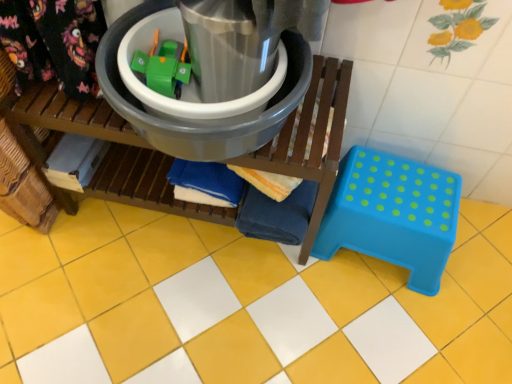
Describe the element at coordinates (195, 124) in the screenshot. I see `metallic plastic bucket at center` at that location.

You are a GUI agent. You are given a task and a screenshot of the screen. Output one action in this format:
    pyautogui.click(x=<x>, y=<y>)
    Task: Click on the matte plastic bucket at center
    The width and height of the screenshot is (512, 384).
    Given the screenshot: What is the action you would take?
    pyautogui.click(x=106, y=156)

How many degrees apart are the facing directions of blue plastic step stool at lower right and metallic plastic bucket at center?

They differ by 0.0796 degrees in their facing directions.

From the image's perspective, would you say blue plastic step stool at lower right is positioned over metallic plastic bucket at center?

Actually, blue plastic step stool at lower right appears below metallic plastic bucket at center in the image.

Locate an element on the screen. The image size is (512, 384). appliance above the blue plastic step stool at lower right (from the image's perspective) is located at coordinates (195, 124).

How different are the orientations of yellow glossy tile at center and metallic plastic bucket at center in degrees?

91.8 degrees separate the facing orientations of yellow glossy tile at center and metallic plastic bucket at center.

Is yellow glossy tile at center closer to camera compared to metallic plastic bucket at center?

No, it is not.

Is yellow glossy tile at center bigger than metallic plastic bucket at center?

Indeed, yellow glossy tile at center has a larger size compared to metallic plastic bucket at center.

I want to click on ceramic tile located below the metallic plastic bucket at center (from the image's perspective), so click(x=244, y=305).

Is matte plastic bucket at center to the left of blue plastic step stool at lower right from the viewer's perspective?

Yes, matte plastic bucket at center is to the left of blue plastic step stool at lower right.

Which object is more forward, matte plastic bucket at center or blue plastic step stool at lower right?

matte plastic bucket at center is closer to the camera.

Which of these two, matte plastic bucket at center or blue plastic step stool at lower right, stands shorter?

blue plastic step stool at lower right is shorter.

Is yellow glossy tile at center oriented away from blue plastic step stool at lower right?

yellow glossy tile at center does not have its back to blue plastic step stool at lower right.

In the scene shown: Is the surface of yellow glossy tile at center in direct contact with blue plastic step stool at lower right?

No, yellow glossy tile at center is not touching blue plastic step stool at lower right.

Does yellow glossy tile at center appear on the left side of blue plastic step stool at lower right?

Correct, you'll find yellow glossy tile at center to the left of blue plastic step stool at lower right.

Which of these two, metallic plastic bucket at center or matte plastic bucket at center, stands shorter?

metallic plastic bucket at center.

Which is behind, point (118, 73) or point (339, 153)?

The point (339, 153) is farther from the camera.

Is metallic plastic bucket at center located outside matte plastic bucket at center?

Absolutely, metallic plastic bucket at center is external to matte plastic bucket at center.

In the image, is metallic plastic bucket at center positioned in front of or behind matte plastic bucket at center?

Clearly, metallic plastic bucket at center is in front of matte plastic bucket at center.

Considering the points (435, 198) and (115, 170), which point is in front, point (435, 198) or point (115, 170)?

The point (435, 198) is closer to the camera.

Is blue plastic step stool at lower right positioned with its back to matte plastic bucket at center?

blue plastic step stool at lower right does not have its back to matte plastic bucket at center.

Can you tell me how much blue plastic step stool at lower right and matte plastic bucket at center differ in facing direction?

1.44 degrees separate the facing orientations of blue plastic step stool at lower right and matte plastic bucket at center.

Relative to matte plastic bucket at center, is blue plastic step stool at lower right in front or behind?

blue plastic step stool at lower right is positioned farther from the viewer than matte plastic bucket at center.

Between blue plastic step stool at lower right and yellow glossy tile at center, which one has smaller size?

With smaller size is blue plastic step stool at lower right.

Which is farther, (425, 177) or (154, 272)?

The point (154, 272) is farther.

From the image's perspective, between blue plastic step stool at lower right and yellow glossy tile at center, which one is located above?

blue plastic step stool at lower right, from the image's perspective.

Locate an element on the screen. step stool to the right of metallic plastic bucket at center is located at coordinates (393, 214).

Identify the location of ceramic tile below the metallic plastic bucket at center (from the image's perspective). This screenshot has height=384, width=512. point(244,305).

From the image, which object appears to be nearer to blue plastic step stool at lower right, metallic plastic bucket at center or matte plastic bucket at center?

matte plastic bucket at center lies closer to blue plastic step stool at lower right than the other object.

When comparing their distances from metallic plastic bucket at center, does yellow glossy tile at center or matte plastic bucket at center seem further?

yellow glossy tile at center is further to metallic plastic bucket at center.

Which object lies nearer to the anchor point matte plastic bucket at center, metallic plastic bucket at center or yellow glossy tile at center?

metallic plastic bucket at center is closer to matte plastic bucket at center.

Looking at the image, which one is located further to yellow glossy tile at center, matte plastic bucket at center or metallic plastic bucket at center?

metallic plastic bucket at center.

Looking at the image, which one is located closer to metallic plastic bucket at center, blue plastic step stool at lower right or yellow glossy tile at center?

blue plastic step stool at lower right.

Considering their positions, is matte plastic bucket at center positioned further to metallic plastic bucket at center than yellow glossy tile at center?

The object further to metallic plastic bucket at center is yellow glossy tile at center.

Based on their spatial positions, is matte plastic bucket at center or blue plastic step stool at lower right further from metallic plastic bucket at center?

blue plastic step stool at lower right.

Based on their spatial positions, is blue plastic step stool at lower right or metallic plastic bucket at center closer to matte plastic bucket at center?

Based on the image, metallic plastic bucket at center appears to be nearer to matte plastic bucket at center.

This screenshot has width=512, height=384. I want to click on furniture between metallic plastic bucket at center and yellow glossy tile at center from top to bottom, so click(106, 156).

The width and height of the screenshot is (512, 384). What are the coordinates of `appliance between matte plastic bucket at center and blue plastic step stool at lower right` in the screenshot? It's located at (195, 124).

You are a GUI agent. You are given a task and a screenshot of the screen. Output one action in this format:
    pyautogui.click(x=<x>, y=<y>)
    Task: Click on the ceramic tile between matte plastic bucket at center and blue plastic step stool at lower right from left to right
    
    Given the screenshot: What is the action you would take?
    pyautogui.click(x=244, y=305)

Identify the location of ceramic tile situated between metallic plastic bucket at center and blue plastic step stool at lower right from left to right. This screenshot has height=384, width=512. (244, 305).